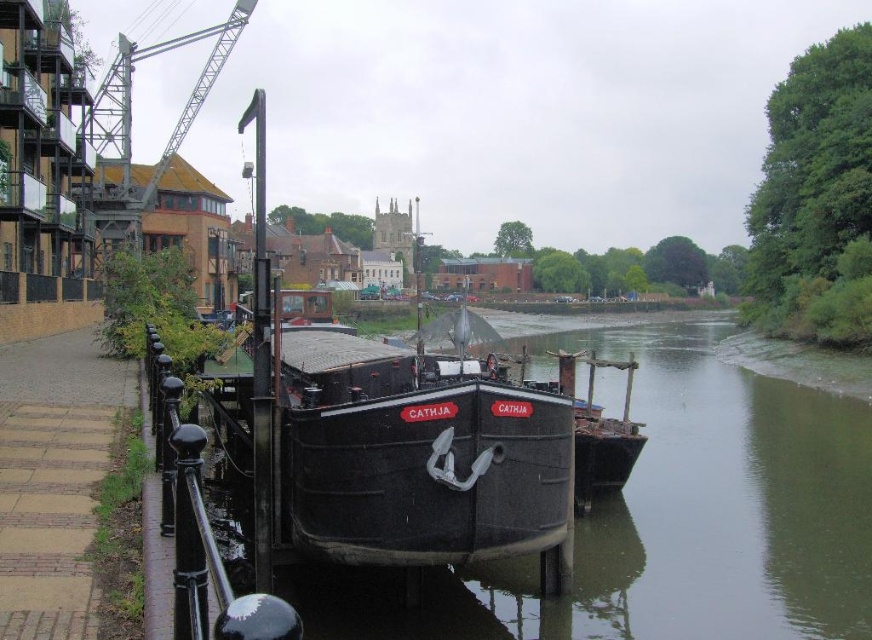
Question: Which point is closer to the camera?

Choices:
 (A) (283, 605)
 (B) (121, 221)

Answer: (A)

Question: Considering the real-world distances, which object is farthest from the metallic gray crane at upper left?

Choices:
 (A) black metal/rail at left
 (B) black matte boat at center

Answer: (A)

Question: Based on their relative distances, which object is farther from the metallic gray crane at upper left?

Choices:
 (A) black metal/rail at left
 (B) black matte boat at center

Answer: (A)

Question: Is black matte boat at center positioned in front of metallic gray crane at upper left?

Choices:
 (A) yes
 (B) no

Answer: (A)

Question: Is black metal/rail at left bigger than metallic gray crane at upper left?

Choices:
 (A) no
 (B) yes

Answer: (A)

Question: Does black metal/rail at left have a lesser width compared to metallic gray crane at upper left?

Choices:
 (A) yes
 (B) no

Answer: (A)